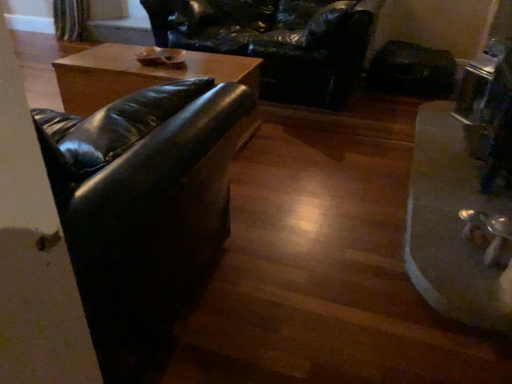
Identify the location of free location in front of black leather swivel chair at upper center. The height and width of the screenshot is (384, 512). (317, 155).